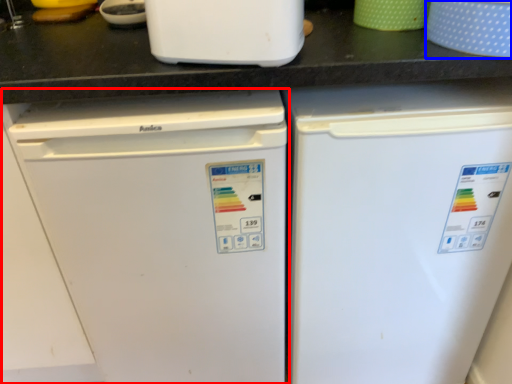
Question: Which point is further to the camera, refrigerator (highlighted by a red box) or appliance (highlighted by a blue box)?

Choices:
 (A) refrigerator
 (B) appliance

Answer: (A)